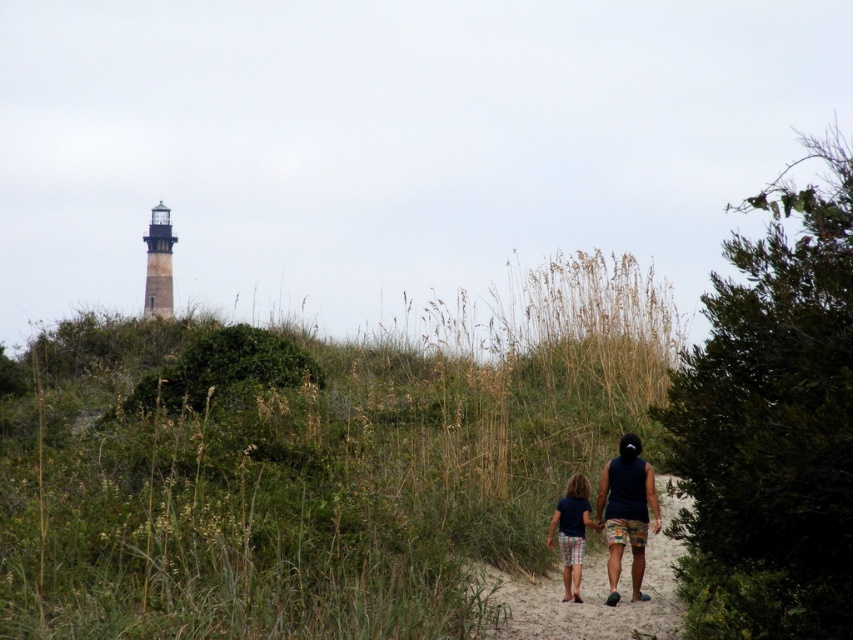
You are a hiker trying to reach the lighthouse on the hill. You see the textured sand path at center and the dark blue tank top at center. Which object is closer to the lighthouse?

The textured sand path at center is below the dark blue tank top at center, meaning the dark blue tank top at center is higher up and closer to the lighthouse on the hill.

You are standing at the starting point of the sandy path and want to reach the lighthouse. There are two markers along the path labeled as point 1 at coordinates point (668,516) and point 2 at coordinates point (634,488). Which point should you reach first while walking towards the lighthouse?

You should reach point 2 at coordinates point (634,488) first because point 1 at coordinates point (668,516) is behind it along the path.